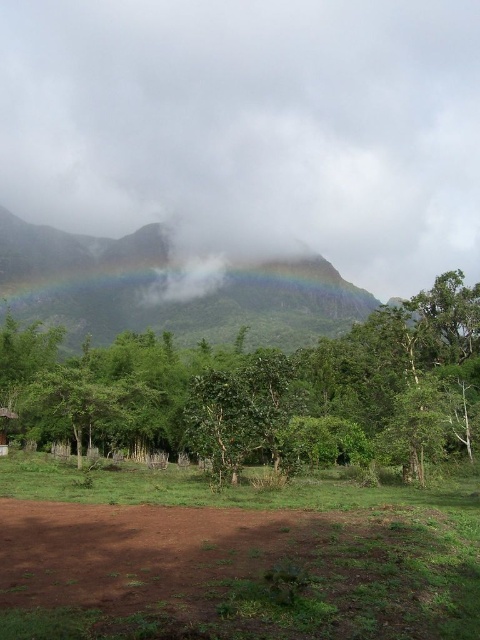
Between point (9, 388) and point (12, 419), which one is positioned behind?

Point (9, 388)

Is green leafy tree at center smaller than brown wooden hut at lower left?

No, green leafy tree at center is not smaller than brown wooden hut at lower left.

The width and height of the screenshot is (480, 640). Find the location of `green leafy tree at center`. green leafy tree at center is located at coordinates (264, 392).

Where is `green leafy tree at center`? green leafy tree at center is located at coordinates (264, 392).

Can you confirm if brown soil at lower left is positioned to the right of green leafy tree at center?

No, brown soil at lower left is not to the right of green leafy tree at center.

Who is higher up, brown soil at lower left or green leafy tree at center?

green leafy tree at center is above.

Which is in front, point (288, 566) or point (168, 445)?

Point (288, 566) is in front.

You are a GUI agent. You are given a task and a screenshot of the screen. Output one action in this format:
    pyautogui.click(x=<x>, y=<y>)
    Task: Click on the brown soil at lower left
    The width and height of the screenshot is (480, 640).
    Given the screenshot: What is the action you would take?
    pos(236,573)

Can you confirm if brown soil at lower left is taller than brown wooden hut at lower left?

No, brown soil at lower left is not taller than brown wooden hut at lower left.

Can you confirm if brown soil at lower left is positioned to the right of brown wooden hut at lower left?

Correct, you'll find brown soil at lower left to the right of brown wooden hut at lower left.

This screenshot has width=480, height=640. Find the location of `brown soil at lower left`. brown soil at lower left is located at coordinates (236, 573).